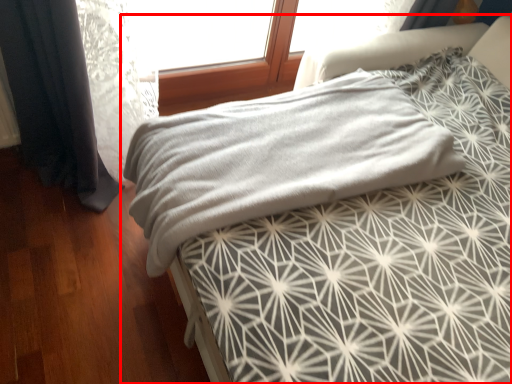
Question: From the image, what is the correct spatial relationship of bed (annotated by the red box) in relation to blanket?

Choices:
 (A) right
 (B) left

Answer: (A)